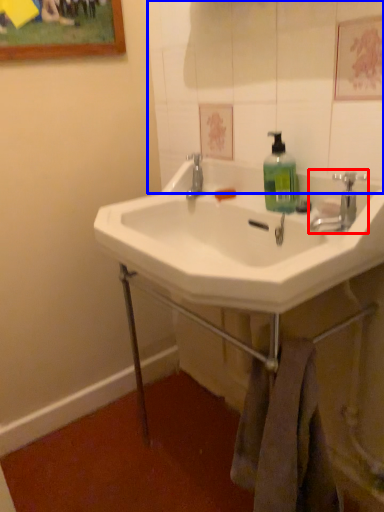
Question: Among these objects, which one is nearest to the camera, tap (highlighted by a red box) or mirror (highlighted by a blue box)?

Choices:
 (A) tap
 (B) mirror

Answer: (B)